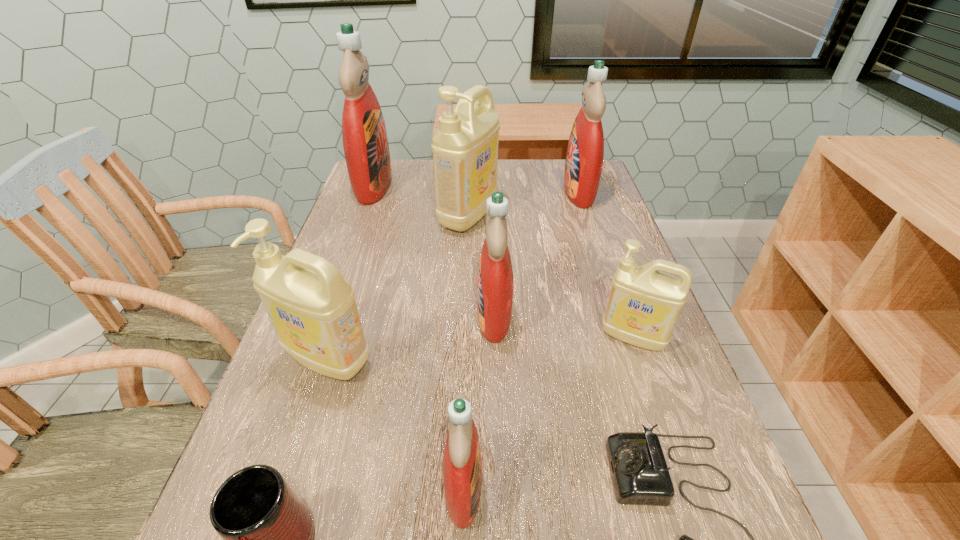
Where is `the tallest object`? This screenshot has height=540, width=960. the tallest object is located at coordinates (365, 142).

Locate an element on the screen. Image resolution: width=960 pixels, height=540 pixels. the biggest red detergent is located at coordinates (365, 142).

I want to click on the second beige detergent from left to right, so click(465, 148).

Find the location of `the farthest beige detergent`. the farthest beige detergent is located at coordinates (465, 148).

Where is `the rightmost red detergent`? The width and height of the screenshot is (960, 540). the rightmost red detergent is located at coordinates (585, 152).

Where is `the third biggest red detergent`? The image size is (960, 540). the third biggest red detergent is located at coordinates 495,281.

This screenshot has width=960, height=540. What are the coordinates of `the second smallest beige detergent` in the screenshot? It's located at (312, 308).

Where is `the smallest beige detergent`? the smallest beige detergent is located at coordinates (644, 304).

This screenshot has width=960, height=540. In order to click on the smallest red detergent in this screenshot , I will do `click(462, 463)`.

The image size is (960, 540). I want to click on the nearest red detergent, so click(462, 463).